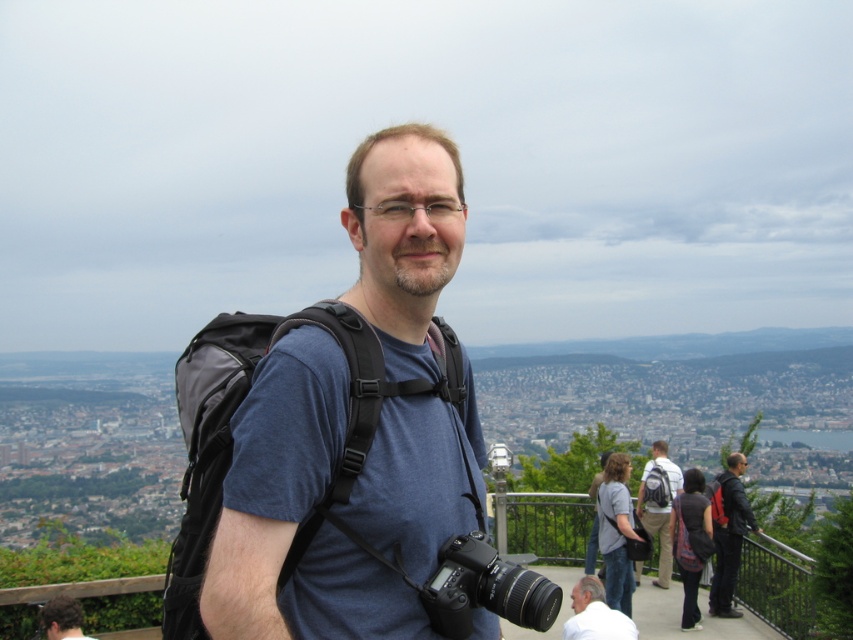
Does matte black backpack at center appear on the left side of matte blue shirt at center?

Correct, you'll find matte black backpack at center to the left of matte blue shirt at center.

Does point (67, 637) lie behind point (590, 534)?

No, (67, 637) is in front of (590, 534).

Identify the location of matte black backpack at center. Image resolution: width=853 pixels, height=640 pixels. (62, 618).

Is white matte shirt at lower right smaller than matte gray backpack at center?

Indeed, white matte shirt at lower right has a smaller size compared to matte gray backpack at center.

Is point (614, 627) behind point (659, 520)?

No, it is in front of (659, 520).

In order to click on white matte shirt at lower right in this screenshot , I will do `click(595, 614)`.

Is matte gray backpack at center positioned behind matte black backpack at center?

Yes, matte gray backpack at center is further from the viewer.

Does point (663, 458) lie behind point (82, 620)?

Yes, point (663, 458) is farther from viewer.

This screenshot has width=853, height=640. Find the location of `matte gray backpack at center`. matte gray backpack at center is located at coordinates (659, 509).